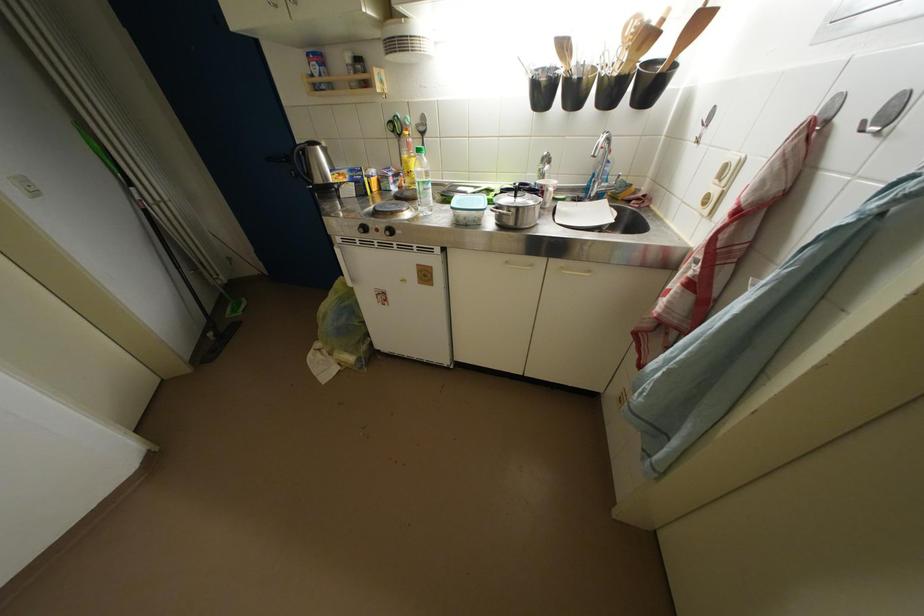
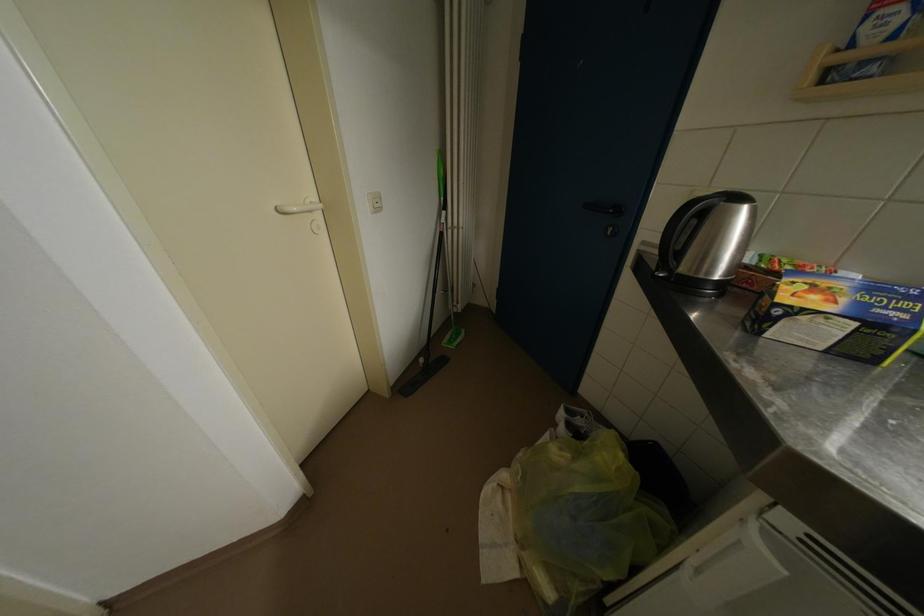
Where in the second image is the point corresponding to point 137,188 from the first image?

(451, 211)